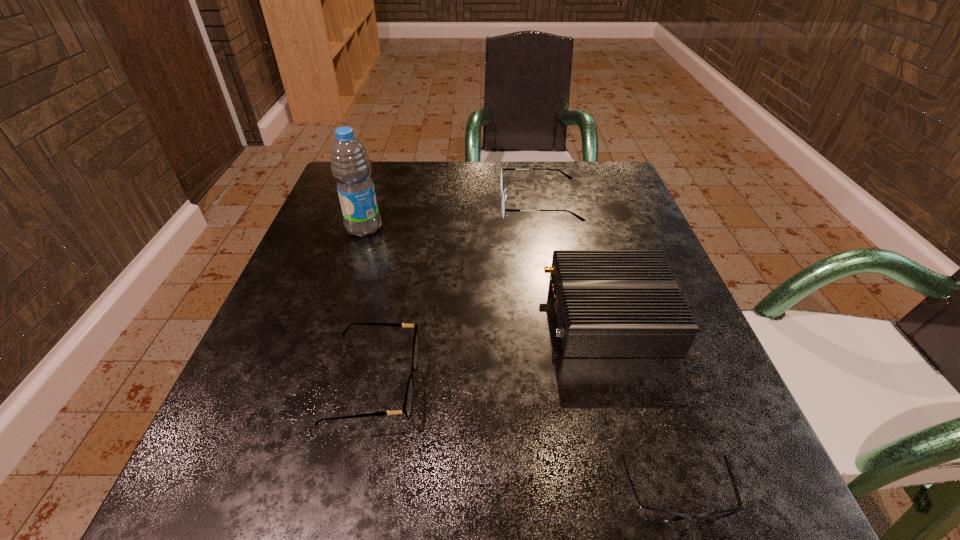
You are a GUI agent. You are given a task and a screenshot of the screen. Output one action in this format:
    pyautogui.click(x=<x>, y=<y>)
    Task: Click on the tallest object
    
    Given the screenshot: What is the action you would take?
    coord(350,164)

Where is `router`? This screenshot has width=960, height=540. router is located at coordinates (609, 303).

This screenshot has height=540, width=960. In order to click on the third shortest object in this screenshot , I will do point(504,196).

Where is `the tallest spectacles`? the tallest spectacles is located at coordinates (504, 196).

This screenshot has width=960, height=540. I want to click on the second farthest spectacles, so click(408, 402).

Locate an element on the screen. Image resolution: width=960 pixels, height=540 pixels. the nearest object is located at coordinates (658, 515).

Locate an element on the screen. The width and height of the screenshot is (960, 540). vacant point located on the back of the water bottle is located at coordinates (377, 189).

Find the location of `free point located on the back panel of the router`. free point located on the back panel of the router is located at coordinates (308, 315).

Find the location of a particular element. vacant point located 0.130m on the back panel of the router is located at coordinates (469, 315).

Find the location of a particular element. vacant point located 0.190m on the back panel of the router is located at coordinates (434, 315).